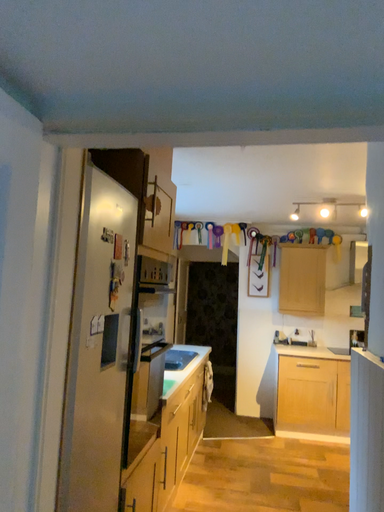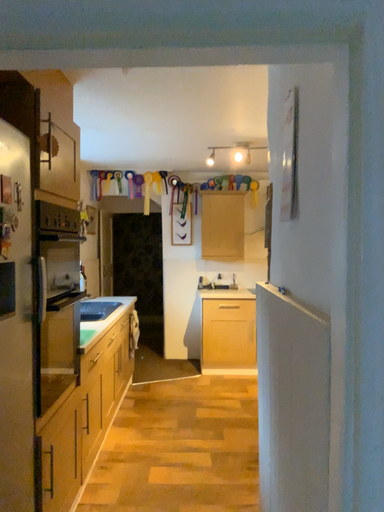
Question: Which way did the camera rotate in the video?

Choices:
 (A) rotated left
 (B) rotated right

Answer: (B)